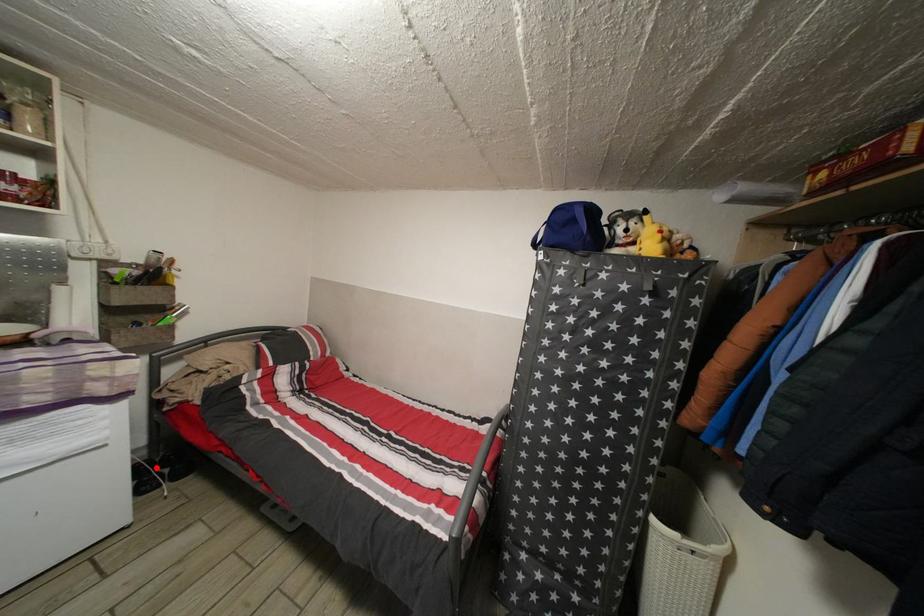
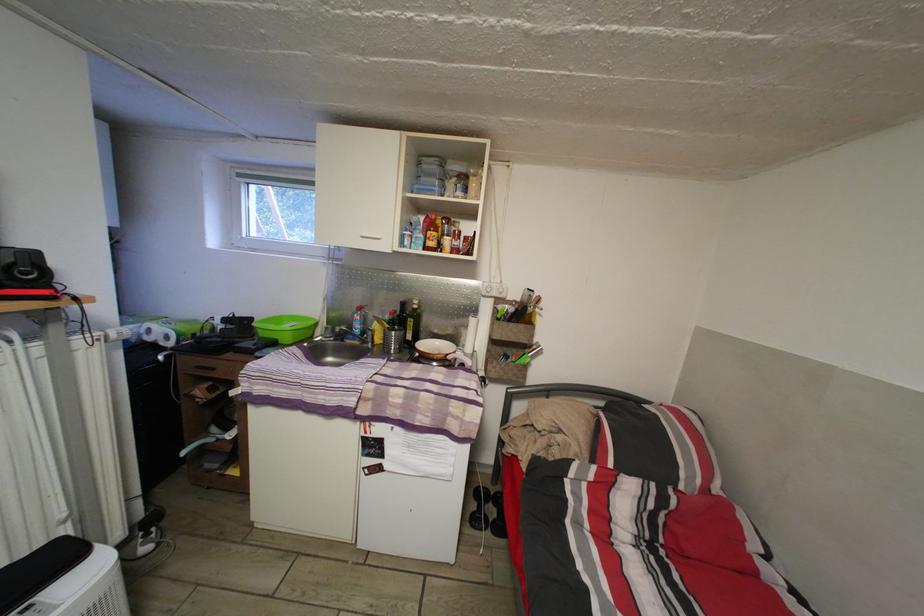
Question: I am providing you with two images of the same scene from different viewpoints. A red point is shown in image1. For the corresponding object point in image2, is it positioned nearer or farther from the camera?

Choices:
 (A) Nearer
 (B) Farther

Answer: (A)